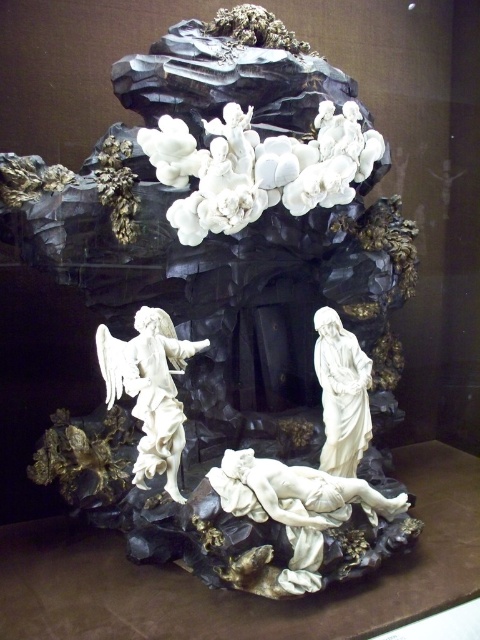
You are an art conservator examining the sculpture from the front. You notice the white porcelain cloud at upper center and the white porcelain angel at left. Which object is closer to you?

The white porcelain cloud at upper center is closer to you because the white porcelain angel at left is behind it.

You are standing in front of the sculpture and want to touch the point at coordinates point (179,141). If your arm can reach 1.8 meters, can you reach it?

The point (179,141) is 5.05 meters away from the camera, so no, you cannot reach it with an arm that can only extend 1.8 meters.

You are an art conservator standing 5 meters away from the sculpture. You notice the white porcelain cloud at upper center. Can you reach it with a 1.2 meter long conservation tool?

The white porcelain cloud at upper center is 4.95 meters away from the viewer. Since you are standing 5 meters away, the tool can extend to 1.2 meters, so the total reach would be 6.2 meters. Therefore, you can reach the white porcelain cloud at upper center with the conservation tool.